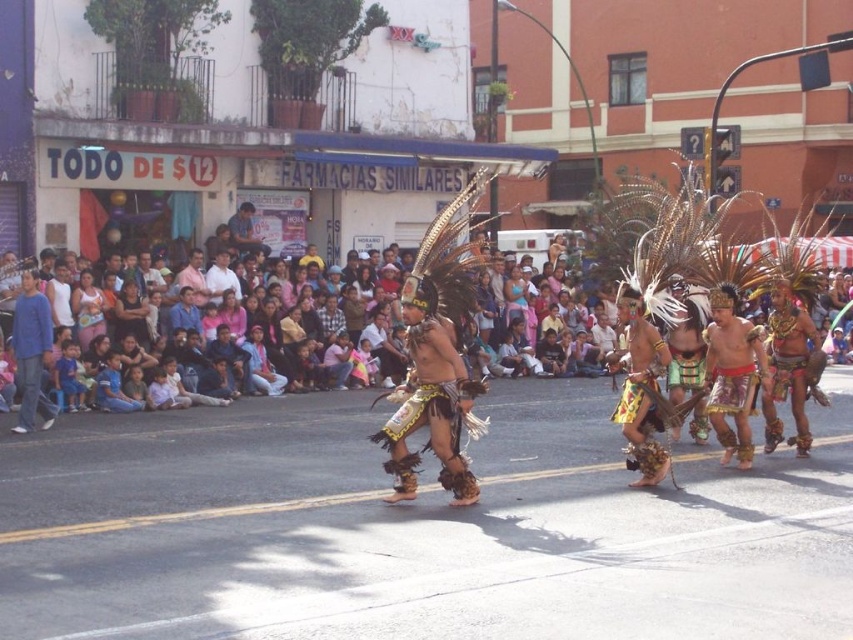
Question: Does blue cotton shirt at left appear under matte black shirt at center?

Choices:
 (A) no
 (B) yes

Answer: (B)

Question: Which object is positioned farthest from the matte black shirt at center?

Choices:
 (A) blue cotton shirt at left
 (B) matte skin people at center

Answer: (A)

Question: Where is blue cotton shirt at left located in relation to matte skin people at center in the image?

Choices:
 (A) above
 (B) below

Answer: (A)

Question: Which point appears farthest from the camera in this image?

Choices:
 (A) (256, 243)
 (B) (68, 368)

Answer: (A)

Question: Which of the following is the closest to the observer?

Choices:
 (A) matte black shirt at center
 (B) blue cotton shirt at left

Answer: (B)

Question: Observing the image, what is the correct spatial positioning of matte skin people at center in reference to matte black shirt at center?

Choices:
 (A) above
 (B) below

Answer: (B)